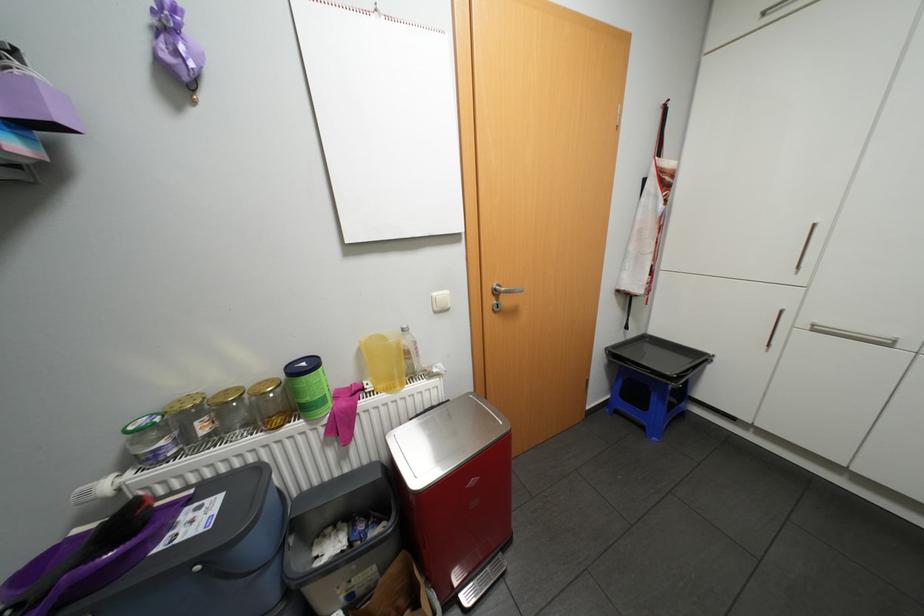
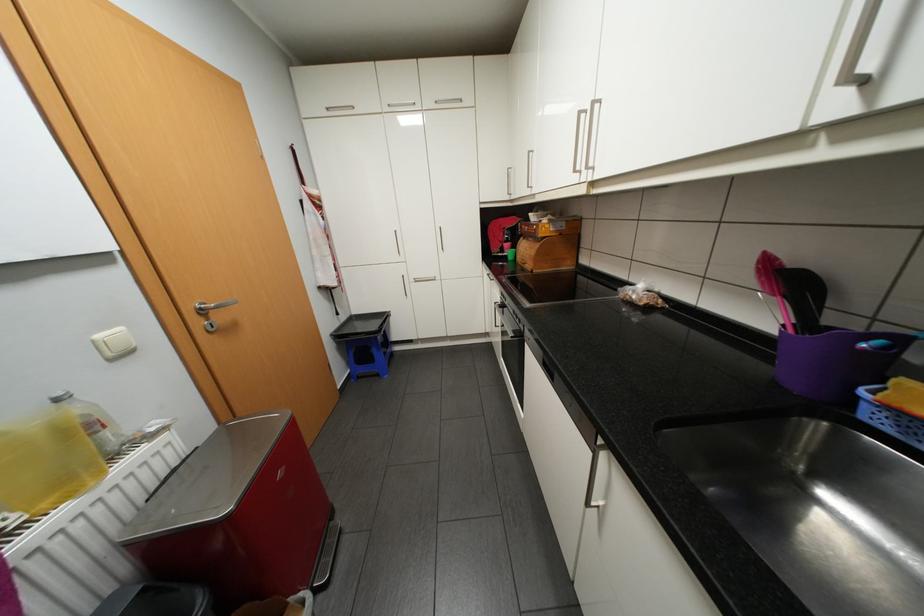
Locate, in the second image, the point that corresponds to the point at 504,289 in the first image.

(209, 308)